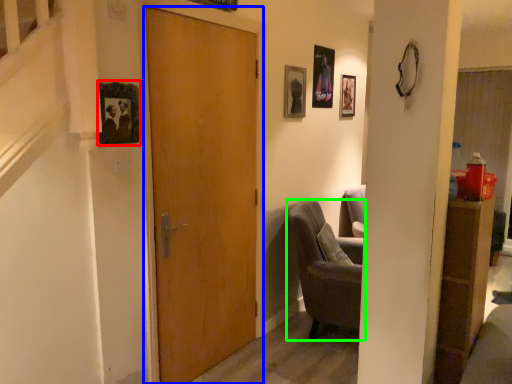
Question: Estimate the real-world distances between objects in this image. Which object is closer to picture frame (highlighted by a red box), door (highlighted by a blue box) or chair (highlighted by a green box)?

Choices:
 (A) door
 (B) chair

Answer: (A)